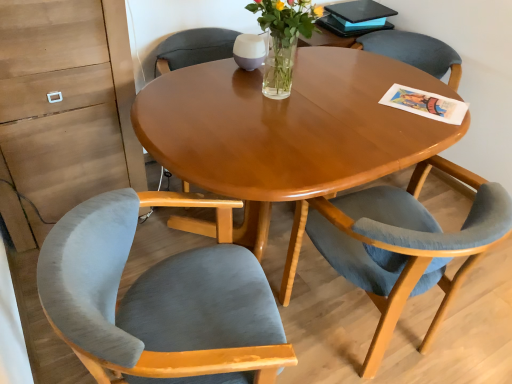
Question: From the image's perspective, is velvet grey chair at left, the second chair when ordered from right to left, on top of velvet blue chair at lower right, positioned as the 1th chair in right-to-left order?

Choices:
 (A) no
 (B) yes

Answer: (A)

Question: Does velvet grey chair at left, which is counted as the first chair, starting from the left, turn towards velvet blue chair at lower right, positioned as the second chair in left-to-right order?

Choices:
 (A) yes
 (B) no

Answer: (A)

Question: Does velvet grey chair at left, the second chair when ordered from right to left, have a lesser height compared to velvet blue chair at lower right, positioned as the 1th chair in right-to-left order?

Choices:
 (A) yes
 (B) no

Answer: (B)

Question: Is velvet grey chair at left, which is counted as the first chair, starting from the left, positioned with its back to velvet blue chair at lower right, positioned as the second chair in left-to-right order?

Choices:
 (A) yes
 (B) no

Answer: (B)

Question: From a real-world perspective, is velvet grey chair at left, which is counted as the first chair, starting from the left, under velvet blue chair at lower right, positioned as the 1th chair in right-to-left order?

Choices:
 (A) no
 (B) yes

Answer: (B)

Question: Is velvet grey chair at left, which is counted as the first chair, starting from the left, spatially inside clear glass vase at center, or outside of it?

Choices:
 (A) inside
 (B) outside

Answer: (B)

Question: Considering the positions of velvet grey chair at left, the second chair when ordered from right to left, and clear glass vase at center in the image, is velvet grey chair at left, the second chair when ordered from right to left, taller or shorter than clear glass vase at center?

Choices:
 (A) tall
 (B) short

Answer: (A)

Question: From the image's perspective, is velvet grey chair at left, the second chair when ordered from right to left, above or below clear glass vase at center?

Choices:
 (A) above
 (B) below

Answer: (B)

Question: Looking at the image, does velvet grey chair at left, which is counted as the first chair, starting from the left, seem bigger or smaller compared to clear glass vase at center?

Choices:
 (A) small
 (B) big

Answer: (B)

Question: Looking at their shapes, would you say velvet blue chair at lower right, positioned as the second chair in left-to-right order, is wider or thinner than clear glass vase at center?

Choices:
 (A) thin
 (B) wide

Answer: (B)

Question: Visually, is velvet blue chair at lower right, positioned as the second chair in left-to-right order, positioned to the left or to the right of clear glass vase at center?

Choices:
 (A) right
 (B) left

Answer: (A)

Question: Which is correct: velvet blue chair at lower right, positioned as the 1th chair in right-to-left order, is inside clear glass vase at center, or outside of it?

Choices:
 (A) outside
 (B) inside

Answer: (A)

Question: From a real-world perspective, is velvet blue chair at lower right, positioned as the second chair in left-to-right order, above or below clear glass vase at center?

Choices:
 (A) above
 (B) below

Answer: (B)

Question: Considering the relative positions of velvet blue chair at lower right, positioned as the 1th chair in right-to-left order, and velvet grey chair at left, which is counted as the first chair, starting from the left, in the image provided, is velvet blue chair at lower right, positioned as the 1th chair in right-to-left order, to the left or to the right of velvet grey chair at left, which is counted as the first chair, starting from the left,?

Choices:
 (A) left
 (B) right

Answer: (B)

Question: Considering the positions of point (393, 208) and point (165, 309), is point (393, 208) closer or farther from the camera than point (165, 309)?

Choices:
 (A) closer
 (B) farther

Answer: (B)